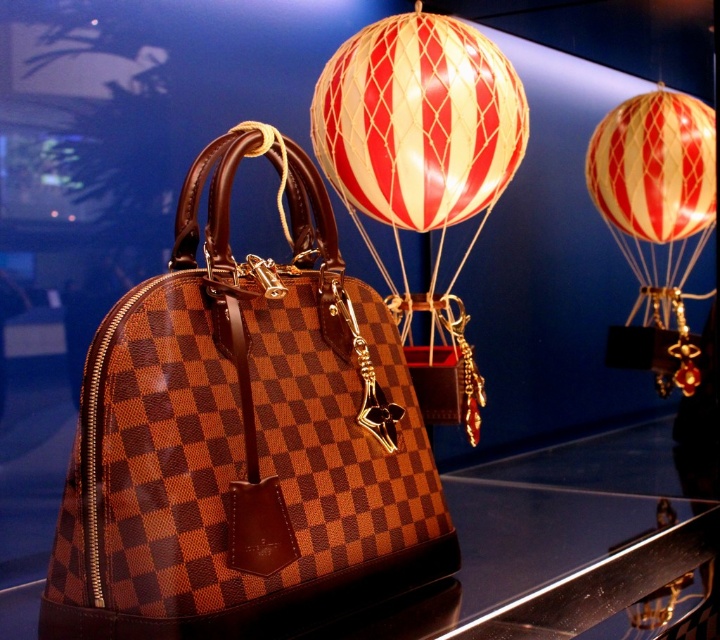
You are a customer in a store and want to know if the brown checkered bag at center can fit inside the red striped balloon at upper right. Based on their sizes, what do you think?

The brown checkered bag at center is bigger than the red striped balloon at upper right, so it cannot fit inside.

You are standing in front of the handbag display and want to place a small decorative item exactly at the point marked as point (x=508, y=486). Given that the camera is positioned at your eye level, can you estimate how far you need to reach to place the item at that point?

The point (x=508, y=486) is 4.48 feet from the camera, so you need to reach approximately 4.48 feet to place the item there.